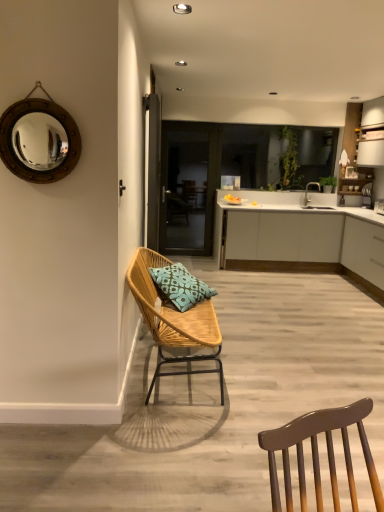
Question: Is the depth of woven wood chair with blue patterned cushion at left greater than that of wooden frame mirror at upper left?

Choices:
 (A) no
 (B) yes

Answer: (B)

Question: Could wooden frame mirror at upper left be considered to be inside woven wood chair with blue patterned cushion at left?

Choices:
 (A) no
 (B) yes

Answer: (A)

Question: From the image's perspective, does woven wood chair with blue patterned cushion at left appear lower than wooden frame mirror at upper left?

Choices:
 (A) no
 (B) yes

Answer: (B)

Question: From a real-world perspective, is woven wood chair with blue patterned cushion at left physically below wooden frame mirror at upper left?

Choices:
 (A) no
 (B) yes

Answer: (B)

Question: Would you consider woven wood chair with blue patterned cushion at left to be distant from wooden frame mirror at upper left?

Choices:
 (A) no
 (B) yes

Answer: (B)

Question: From their relative heights in the image, would you say teal fabric pillow at center is taller or shorter than white matte cabinet at right, which is counted as the first cabinetry, starting from the front?

Choices:
 (A) short
 (B) tall

Answer: (A)

Question: Is point (157, 268) positioned closer to the camera than point (379, 283)?

Choices:
 (A) farther
 (B) closer

Answer: (B)

Question: From a real-world perspective, is teal fabric pillow at center physically located above or below white matte cabinet at right, placed as the 2th cabinetry when sorted from back to front?

Choices:
 (A) below
 (B) above

Answer: (B)

Question: Visually, is teal fabric pillow at center positioned to the left or to the right of white matte cabinet at right, placed as the 2th cabinetry when sorted from back to front?

Choices:
 (A) right
 (B) left

Answer: (B)

Question: From the image's perspective, is white matte cabinet at right, which is counted as the first cabinetry, starting from the front, positioned above or below teal fabric pillow at center?

Choices:
 (A) above
 (B) below

Answer: (A)

Question: Considering the positions of white matte cabinet at right, which is counted as the first cabinetry, starting from the front, and teal fabric pillow at center in the image, is white matte cabinet at right, which is counted as the first cabinetry, starting from the front, wider or thinner than teal fabric pillow at center?

Choices:
 (A) thin
 (B) wide

Answer: (B)

Question: Is white matte cabinet at right, which is counted as the first cabinetry, starting from the front, taller or shorter than teal fabric pillow at center?

Choices:
 (A) tall
 (B) short

Answer: (A)

Question: Looking at the image, does white matte cabinet at right, placed as the 2th cabinetry when sorted from back to front, seem bigger or smaller compared to teal fabric pillow at center?

Choices:
 (A) small
 (B) big

Answer: (B)

Question: In the image, is woven wood chair with blue patterned cushion at left positioned in front of or behind transparent glass door at center?

Choices:
 (A) front
 (B) behind

Answer: (A)

Question: In terms of size, does woven wood chair with blue patterned cushion at left appear bigger or smaller than transparent glass door at center?

Choices:
 (A) big
 (B) small

Answer: (A)